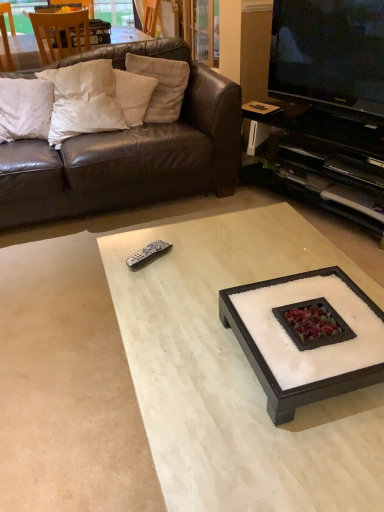
What are the coordinates of `free location in front of white marble coffee table at center, acting as the first coffee table starting from the top` in the screenshot? It's located at (299, 456).